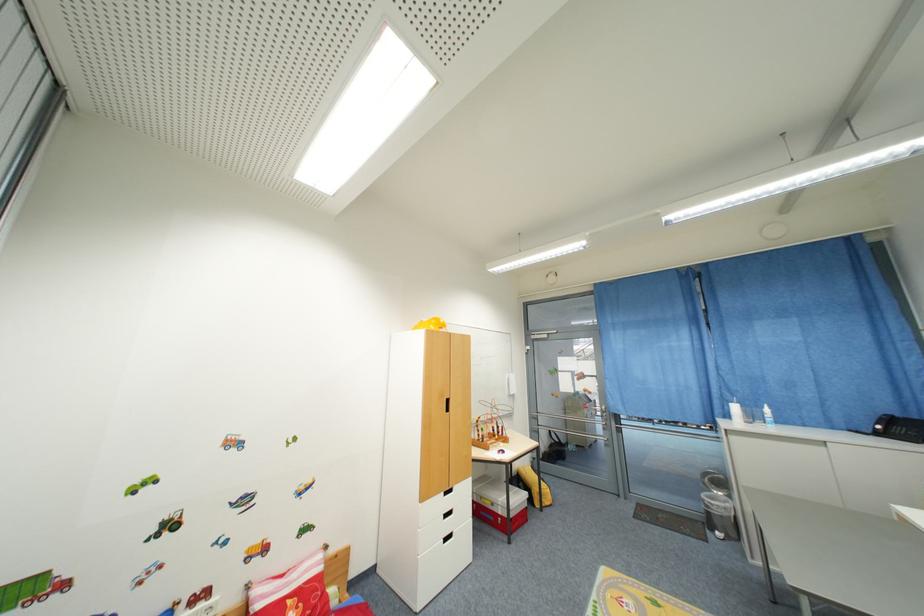
Where would you pull the metal door handle? Please return your answer as a coordinate pair (x, y).

(565, 416)